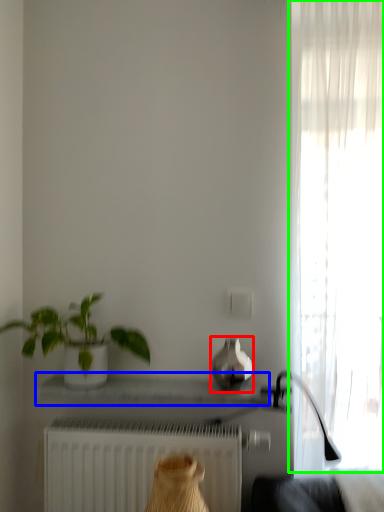
Question: Which object is the farthest from vase (highlighted by a red box)? Choose among these: window sill (highlighted by a blue box) or curtain (highlighted by a green box).

Choices:
 (A) window sill
 (B) curtain

Answer: (B)